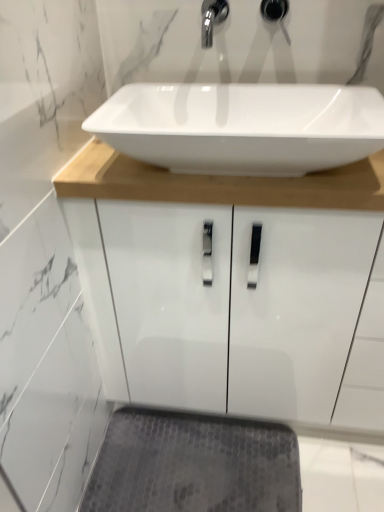
Question: Is matte black faucet at upper center oriented away from gray textured bath mat at lower center?

Choices:
 (A) yes
 (B) no

Answer: (B)

Question: Considering the relative positions of matte black faucet at upper center and gray textured bath mat at lower center in the image provided, is matte black faucet at upper center to the left of gray textured bath mat at lower center from the viewer's perspective?

Choices:
 (A) yes
 (B) no

Answer: (B)

Question: Can you confirm if matte black faucet at upper center is thinner than gray textured bath mat at lower center?

Choices:
 (A) no
 (B) yes

Answer: (B)

Question: Does matte black faucet at upper center have a greater height compared to gray textured bath mat at lower center?

Choices:
 (A) no
 (B) yes

Answer: (B)

Question: Is matte black faucet at upper center bigger than gray textured bath mat at lower center?

Choices:
 (A) no
 (B) yes

Answer: (A)

Question: Considering the relative sizes of matte black faucet at upper center and gray textured bath mat at lower center in the image provided, is matte black faucet at upper center smaller than gray textured bath mat at lower center?

Choices:
 (A) yes
 (B) no

Answer: (A)

Question: Considering the relative positions of white glossy sink at center and matte black faucet at upper center in the image provided, is white glossy sink at center in front of matte black faucet at upper center?

Choices:
 (A) no
 (B) yes

Answer: (B)

Question: From a real-world perspective, is white glossy sink at center over matte black faucet at upper center?

Choices:
 (A) yes
 (B) no

Answer: (B)

Question: Could you tell me if white glossy sink at center is facing matte black faucet at upper center?

Choices:
 (A) yes
 (B) no

Answer: (B)

Question: Considering the relative positions of white glossy sink at center and matte black faucet at upper center in the image provided, is white glossy sink at center to the right of matte black faucet at upper center from the viewer's perspective?

Choices:
 (A) yes
 (B) no

Answer: (B)

Question: Is white glossy sink at center oriented away from matte black faucet at upper center?

Choices:
 (A) yes
 (B) no

Answer: (B)

Question: Would you consider white glossy sink at center to be distant from matte black faucet at upper center?

Choices:
 (A) yes
 (B) no

Answer: (B)

Question: Could matte black faucet at upper center be considered to be inside gray textured bath mat at lower center?

Choices:
 (A) yes
 (B) no

Answer: (B)